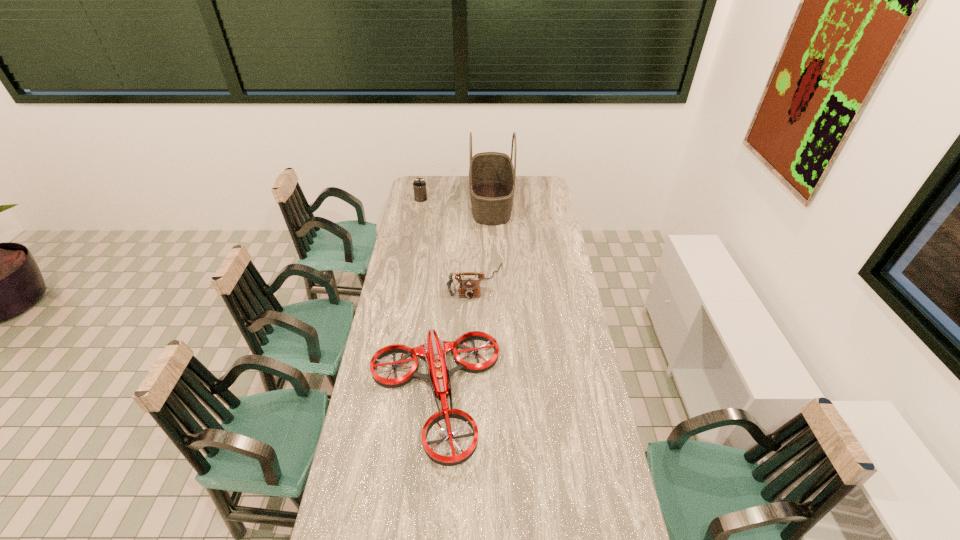
Identify the location of can that is positioned at the left edge. (419, 185).

Where is `drone that is at the left edge`? drone that is at the left edge is located at coordinates (434, 350).

Find the location of a particular element. object that is at the far left corner is located at coordinates (419, 185).

Find the location of `vacant position at the far edge of the desktop`. vacant position at the far edge of the desktop is located at coordinates (461, 182).

Where is `vacant space at the left edge of the desktop`? vacant space at the left edge of the desktop is located at coordinates (391, 356).

Locate an element on the screen. The height and width of the screenshot is (540, 960). vacant space at the right edge is located at coordinates (612, 539).

Find the location of a particular element. The height and width of the screenshot is (540, 960). vacant space at the far right corner of the desktop is located at coordinates (527, 191).

Locate an element on the screen. free point between the drone and the tallest object is located at coordinates tap(462, 300).

Where is `unoccupied position between the can and the drone`? The width and height of the screenshot is (960, 540). unoccupied position between the can and the drone is located at coordinates (427, 298).

Where is `empty space that is in between the nearest object and the telephone`? empty space that is in between the nearest object and the telephone is located at coordinates (454, 340).